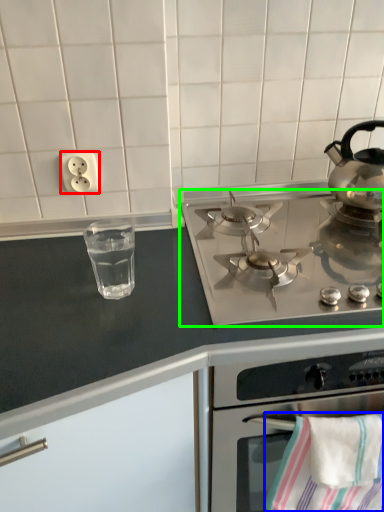
Question: Based on their relative distances, which object is nearer to electric outlet (highlighted by a red box)? Choose from beach towel (highlighted by a blue box) and gas stove (highlighted by a green box).

Choices:
 (A) beach towel
 (B) gas stove

Answer: (B)